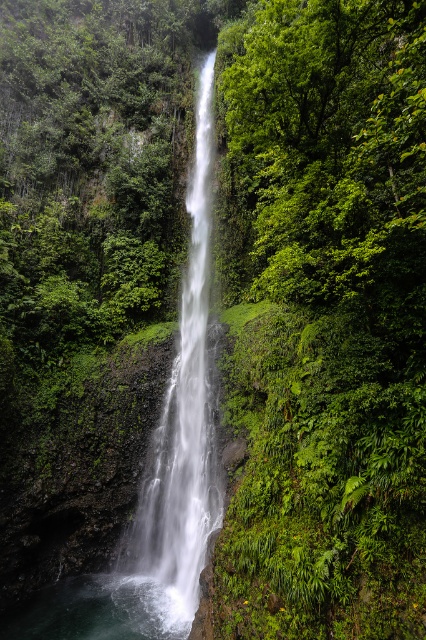
You are standing at the edge of the cliff overlooking the scene. You see the white smooth waterfall at center and the clear water at bottom center. Which object is positioned to the right side of the other?

The white smooth waterfall at center is to the right of clear water at bottom center.

You are a photographer planning to capture the waterfall and the water at its base. You want to ensure that both the white smooth waterfall at center and the clear water at bottom center are visible in your shot. Based on their widths, which one should you focus on to frame the shot properly?

The white smooth waterfall at center might be wider than clear water at bottom center, so you should focus on framing the white smooth waterfall at center to ensure both elements are captured in the shot.

You are standing at the base of the white smooth waterfall at center, and you want to toss a pebble to hit a rock located 12 meters away from you. Will the pebble reach the rock if you throw it from your current position?

The white smooth waterfall at center is 10.55 meters away from the viewer. Since you are at the base, the distance to the rock is 12 meters, which is beyond the waterfall. Therefore, the pebble may not reach the rock as it might fall short or be carried away by the waterfall flow.